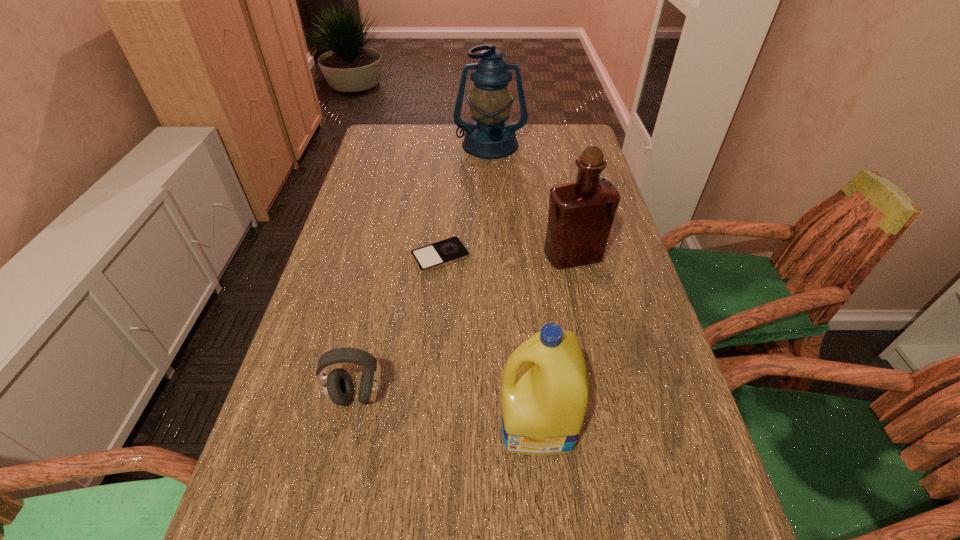
Where is `the farthest object`? This screenshot has height=540, width=960. the farthest object is located at coordinates (490, 101).

You are a GUI agent. You are given a task and a screenshot of the screen. Output one action in this format:
    pyautogui.click(x=<x>, y=<y>)
    Task: Click on the liquor
    The width and height of the screenshot is (960, 540).
    Given the screenshot: What is the action you would take?
    pyautogui.click(x=581, y=214)

This screenshot has width=960, height=540. Find the location of `detergent`. detergent is located at coordinates (544, 394).

I want to click on headset, so click(338, 388).

Identify the location of the second shortest object. (338, 388).

Find the location of `iPod`. iPod is located at coordinates (432, 256).

Locate an element on the screen. The width and height of the screenshot is (960, 540). vacant region located 0.380m on the face of the lantern is located at coordinates (492, 231).

This screenshot has width=960, height=540. I want to click on vacant space located 0.140m on the left of the liquor, so click(488, 256).

Locate an element on the screen. The width and height of the screenshot is (960, 540). vacant space positioned on the label of the detergent is located at coordinates (328, 422).

Where is `free spot located 0.280m on the label of the detergent`? The height and width of the screenshot is (540, 960). free spot located 0.280m on the label of the detergent is located at coordinates (349, 422).